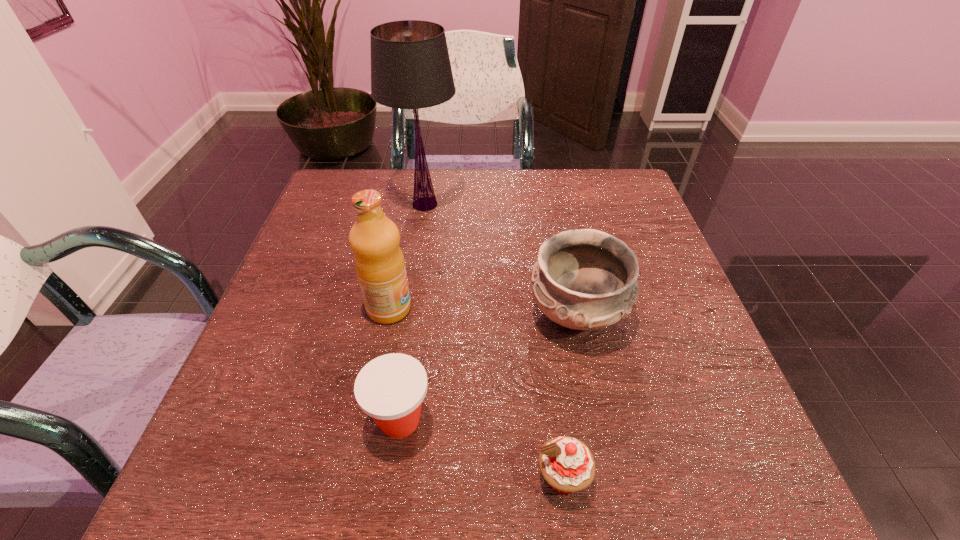
I want to click on free space located 0.250m on the right of the cupcake, so click(750, 477).

The width and height of the screenshot is (960, 540). I want to click on object that is positioned at the far edge, so click(x=410, y=66).

Identify the location of Dixie cup situated at the near edge. The width and height of the screenshot is (960, 540). (390, 388).

Where is `cupcake at the near edge`? cupcake at the near edge is located at coordinates (566, 463).

Where is `object present at the right edge`? This screenshot has width=960, height=540. object present at the right edge is located at coordinates (584, 279).

Find the location of a particular element. The height and width of the screenshot is (540, 960). vacant space at the far edge of the desktop is located at coordinates (526, 176).

What are the coordinates of `vacant space at the left edge of the desktop` in the screenshot? It's located at (265, 419).

Image resolution: width=960 pixels, height=540 pixels. In order to click on vacant region at the right edge of the desktop in this screenshot , I will do `click(717, 421)`.

Find the location of a particular element. The width and height of the screenshot is (960, 540). free space at the far left corner of the desktop is located at coordinates (342, 178).

The image size is (960, 540). In the image, there is a desktop. In order to click on vacant area at the near left corner in this screenshot , I will do `click(211, 497)`.